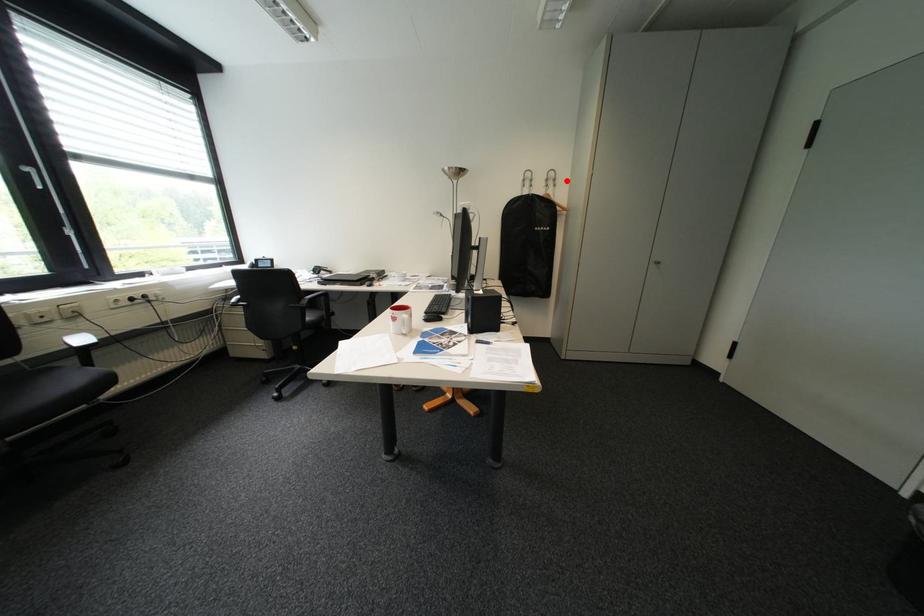
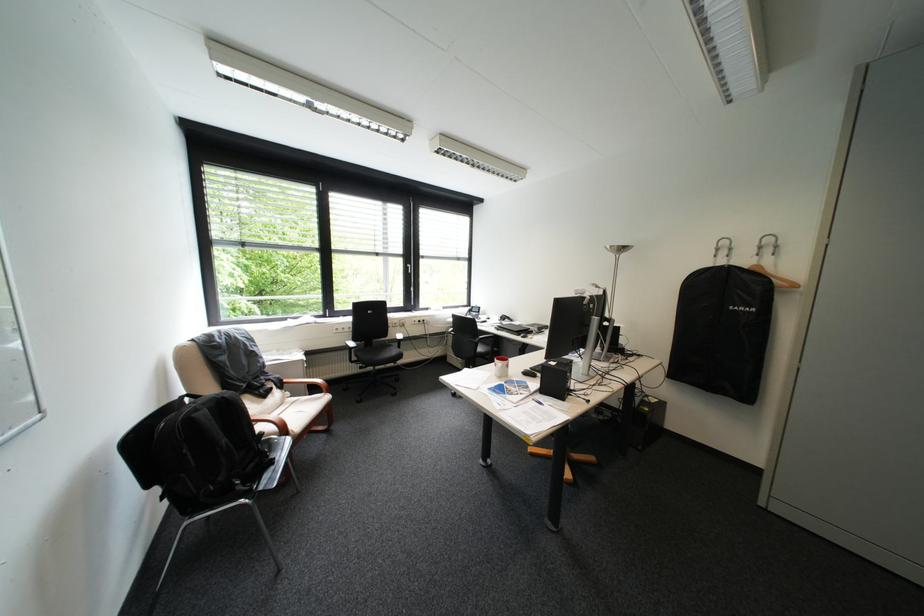
Question: I am providing you with two images of the same scene from different viewpoints. A red point is shown in image1. For the corresponding object point in image2, is it positioned nearer or farther from the camera?

Choices:
 (A) Nearer
 (B) Farther

Answer: (B)